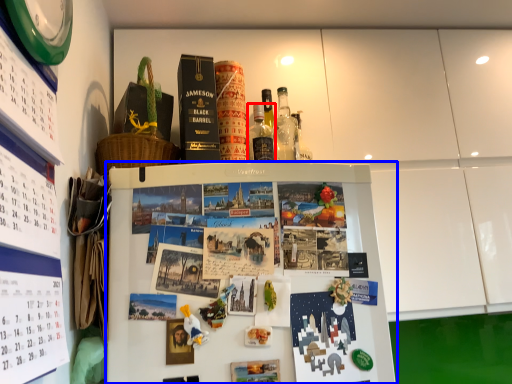
Question: Which object appears farthest to the camera in this image, bottle (highlighted by a red box) or refrigerator (highlighted by a blue box)?

Choices:
 (A) bottle
 (B) refrigerator

Answer: (A)